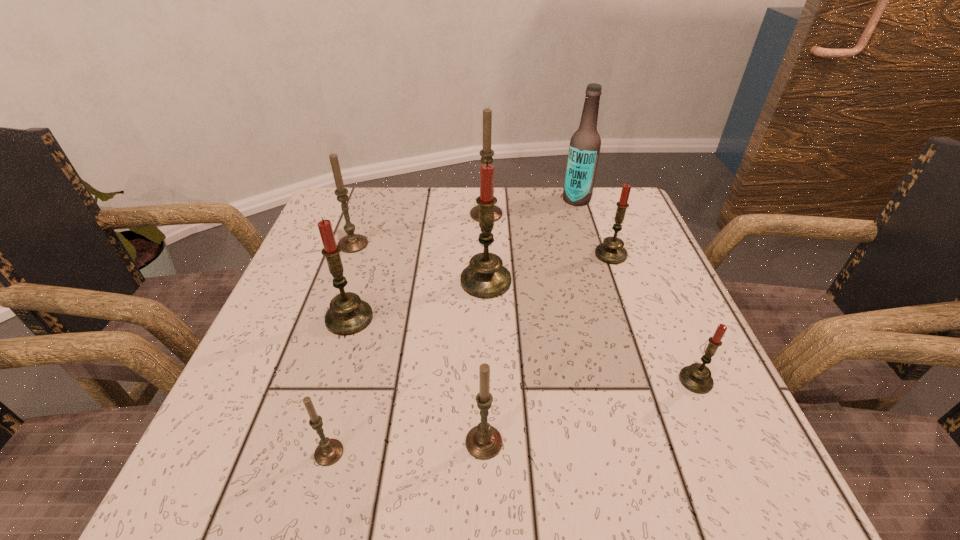
This screenshot has width=960, height=540. Find the location of `the farthest red candle`. the farthest red candle is located at coordinates (611, 251).

The width and height of the screenshot is (960, 540). I want to click on the third biggest gray candle, so click(x=483, y=441).

Find the location of a particular element. Image resolution: width=960 pixels, height=540 pixels. the rightmost candle is located at coordinates (696, 378).

At what (x,y) coordinates should I click in order to perform the action: click on the third nearest candle. Please return your answer as a coordinate pair (x, y). Looking at the image, I should click on (696, 378).

You are a GUI agent. You are given a task and a screenshot of the screen. Output one action in this format:
    pyautogui.click(x=<x>, y=<y>)
    Task: Click on the smallest gray candle
    The width and height of the screenshot is (960, 540).
    Given the screenshot: What is the action you would take?
    pyautogui.click(x=329, y=451)

At what (x,y) coordinates should I click in order to perform the action: click on vacant space situated on the side of the beer bottle with the label. Please return your answer as a coordinate pair (x, y). This screenshot has width=960, height=540. Looking at the image, I should click on (448, 199).

Where is `vacant point located 0.230m on the side of the beer bottle with the label`? The image size is (960, 540). vacant point located 0.230m on the side of the beer bottle with the label is located at coordinates (475, 199).

Find the location of a particular element. The width and height of the screenshot is (960, 540). free location located on the side of the beer bottle with the label is located at coordinates click(x=532, y=199).

Locate an element on the screen. The image size is (960, 540). vacant space situated on the right of the fourth farthest candle is located at coordinates (544, 281).

I want to click on vacant space located 0.130m on the left of the farthest gray candle, so click(x=419, y=214).